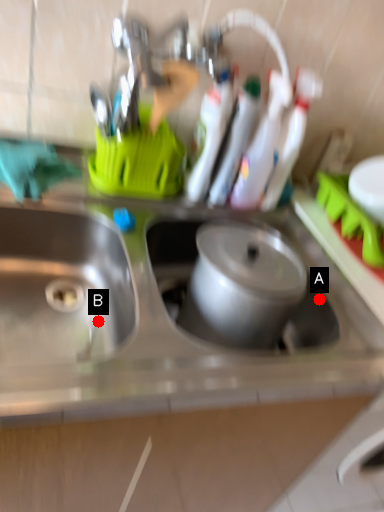
Question: Two points are circled on the image, labeled by A and B beside each circle. Which point is closer to the camera?

Choices:
 (A) A is closer
 (B) B is closer

Answer: (B)